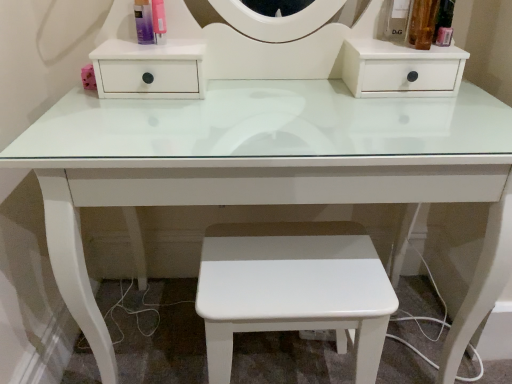
What do you see at coordinates (293, 293) in the screenshot?
I see `white glossy stool at center` at bounding box center [293, 293].

What are the coordinates of `white glossy stool at center` in the screenshot? It's located at (293, 293).

You are a GUI agent. You are given a task and a screenshot of the screen. Output one action in this format:
    pyautogui.click(x=<x>, y=<y>)
    Task: Click on the matte plastic spray at upper left
    This screenshot has width=512, height=384.
    Given the screenshot: What is the action you would take?
    pyautogui.click(x=143, y=22)

The height and width of the screenshot is (384, 512). What do you see at coordinates (143, 22) in the screenshot?
I see `matte plastic spray at upper left` at bounding box center [143, 22].

Locate an element on the screen. Image resolution: width=512 pixels, height=384 pixels. white glossy stool at center is located at coordinates (293, 293).

Considering the relative positions of matte plastic spray at upper left and white glossy stool at center in the image provided, is matte plastic spray at upper left to the left or to the right of white glossy stool at center?

In the image, matte plastic spray at upper left appears on the left side of white glossy stool at center.

From the picture: Does matte plastic spray at upper left lie behind white glossy stool at center?

Yes, matte plastic spray at upper left is further from the viewer.

Is point (138, 38) positioned after point (291, 236)?

Yes, it is.

From the image's perspective, which is above, matte plastic spray at upper left or white glossy stool at center?

matte plastic spray at upper left, from the image's perspective.

From a real-world perspective, is matte plastic spray at upper left below white glossy stool at center?

No.

Considering the relative sizes of matte plastic spray at upper left and white glossy stool at center in the image provided, is matte plastic spray at upper left thinner than white glossy stool at center?

Indeed, matte plastic spray at upper left has a lesser width compared to white glossy stool at center.

In terms of height, does matte plastic spray at upper left look taller or shorter compared to white glossy stool at center?

Clearly, matte plastic spray at upper left is shorter compared to white glossy stool at center.

Considering the relative sizes of matte plastic spray at upper left and white glossy stool at center in the image provided, is matte plastic spray at upper left smaller than white glossy stool at center?

Yes.

Which is correct: matte plastic spray at upper left is inside white glossy stool at center, or outside of it?

matte plastic spray at upper left is spatially situated outside white glossy stool at center.

Would you say matte plastic spray at upper left is a long distance from white glossy stool at center?

No, matte plastic spray at upper left is in close proximity to white glossy stool at center.

Is matte plastic spray at upper left looking in the opposite direction of white glossy stool at center?

No.

Where is `stool on the right of the matte plastic spray at upper left`? stool on the right of the matte plastic spray at upper left is located at coordinates (293, 293).

Between white glossy stool at center and matte plastic spray at upper left, which one appears on the right side from the viewer's perspective?

white glossy stool at center is more to the right.

Which object is further away from the camera taking this photo, white glossy stool at center or matte plastic spray at upper left?

matte plastic spray at upper left is further from the camera.

Does point (228, 278) come in front of point (148, 9)?

That is True.

Consider the image. From the image's perspective, is white glossy stool at center above or below matte plastic spray at upper left?

white glossy stool at center is situated lower than matte plastic spray at upper left in the image.

In the scene shown: From a real-world perspective, who is located higher, white glossy stool at center or matte plastic spray at upper left?

In real-world perspective, matte plastic spray at upper left is above.

Which of these two, white glossy stool at center or matte plastic spray at upper left, is thinner?

With smaller width is matte plastic spray at upper left.

Considering the sizes of objects white glossy stool at center and matte plastic spray at upper left in the image provided, who is taller, white glossy stool at center or matte plastic spray at upper left?

With more height is white glossy stool at center.

Considering the sizes of objects white glossy stool at center and matte plastic spray at upper left in the image provided, who is bigger, white glossy stool at center or matte plastic spray at upper left?

white glossy stool at center.

Do you think white glossy stool at center is within matte plastic spray at upper left, or outside of it?

white glossy stool at center is outside matte plastic spray at upper left.

Is the surface of white glossy stool at center in direct contact with matte plastic spray at upper left?

No, white glossy stool at center is not making contact with matte plastic spray at upper left.

From the picture: Is white glossy stool at center facing towards matte plastic spray at upper left?

No, white glossy stool at center is not oriented towards matte plastic spray at upper left.

Where is `toiletry located above the white glossy stool at center (from the image's perspective)`? The height and width of the screenshot is (384, 512). toiletry located above the white glossy stool at center (from the image's perspective) is located at coordinates (143, 22).

Locate an element on the screen. The image size is (512, 384). toiletry above the white glossy stool at center (from a real-world perspective) is located at coordinates (143, 22).

Locate an element on the screen. Image resolution: width=512 pixels, height=384 pixels. stool located in front of the matte plastic spray at upper left is located at coordinates (293, 293).